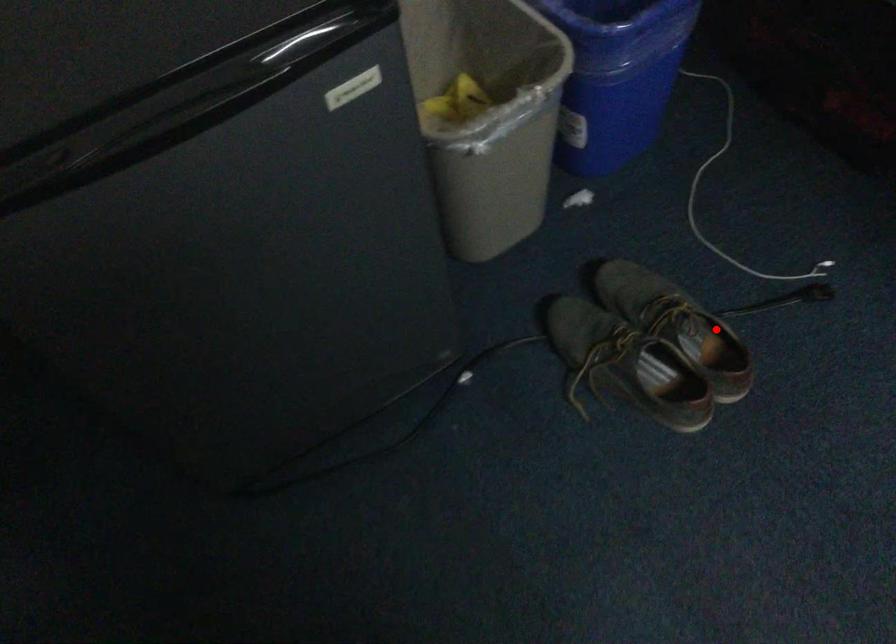
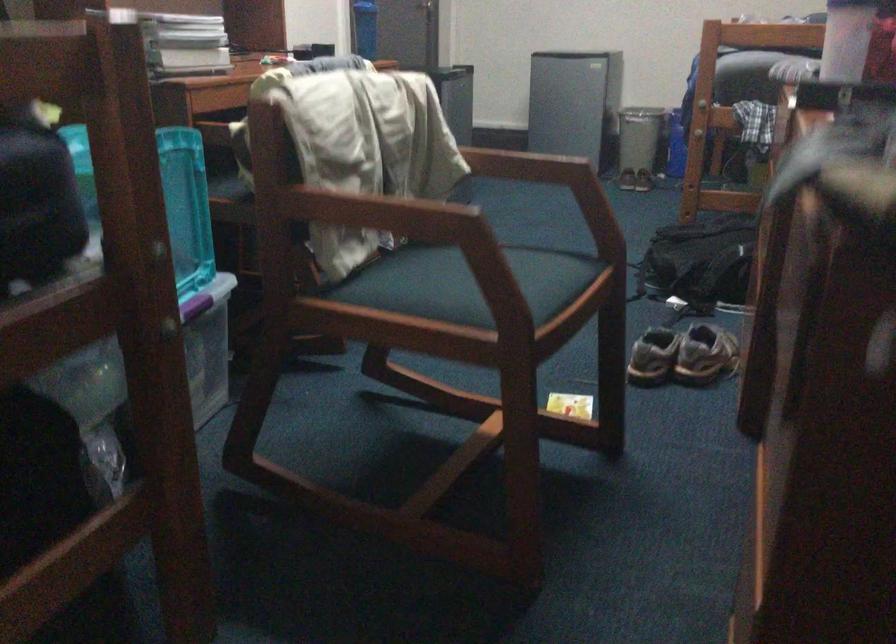
Question: I am providing you with two images of the same scene from different viewpoints. Image1 has a red point marked. In image2, the corresponding 3D location appears at what relative position? Reply with the corresponding letter.

Choices:
 (A) Closer
 (B) Farther

Answer: (B)